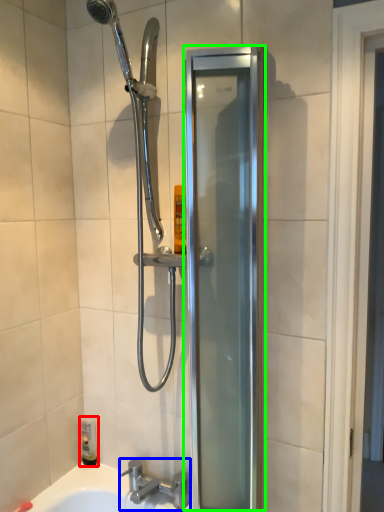
Question: Which object is the closest to the toiletry (highlighted by a red box)? Choose among these: tap (highlighted by a blue box) or screen door (highlighted by a green box).

Choices:
 (A) tap
 (B) screen door

Answer: (A)